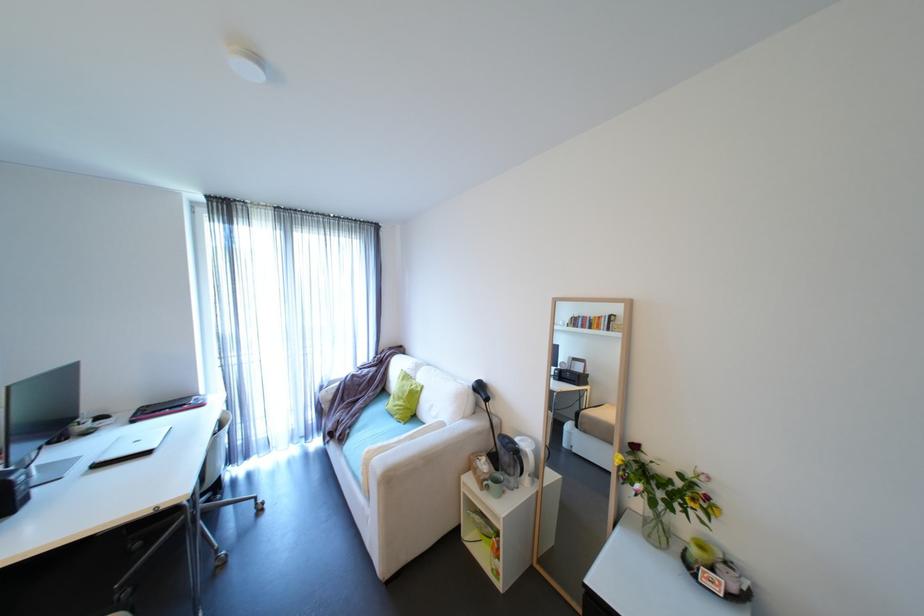
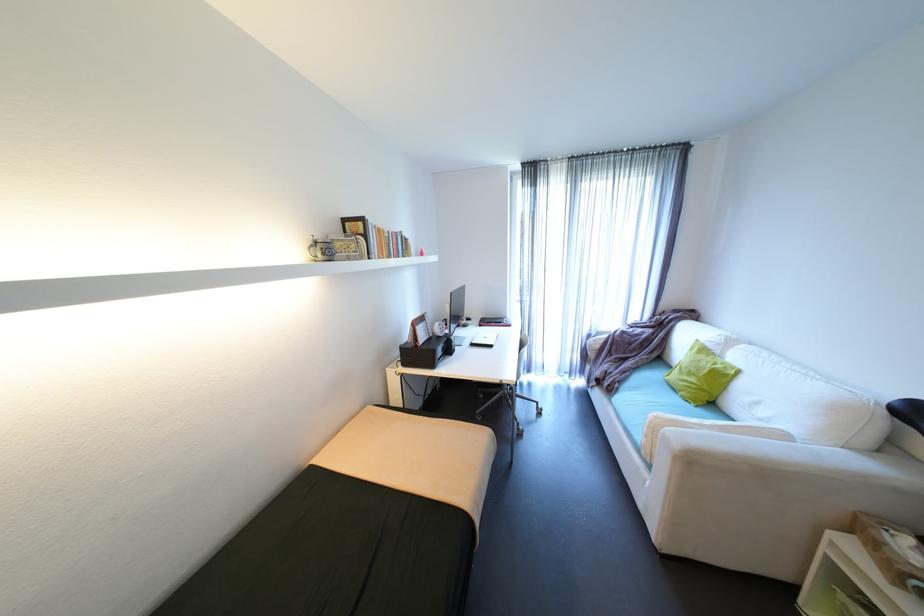
Locate, in the second image, the point that corresponds to point 487,434 in the first image.

(907, 493)